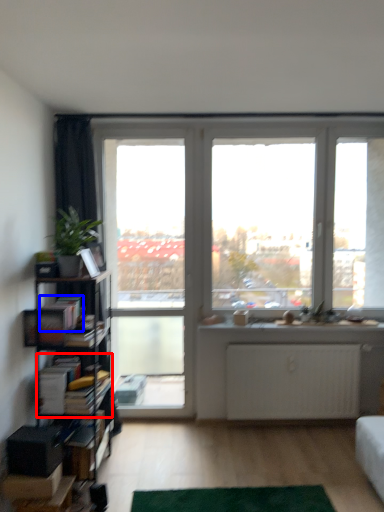
Question: Which object is closer to the camera taking this photo, book (highlighted by a red box) or book (highlighted by a blue box)?

Choices:
 (A) book
 (B) book

Answer: (B)